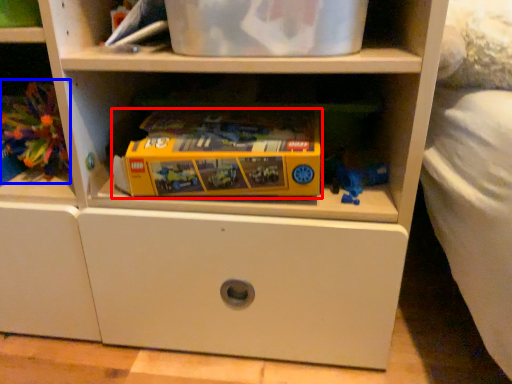
Question: Which object appears closest to the camera in this image, toy (highlighted by a red box) or toy (highlighted by a blue box)?

Choices:
 (A) toy
 (B) toy

Answer: (A)